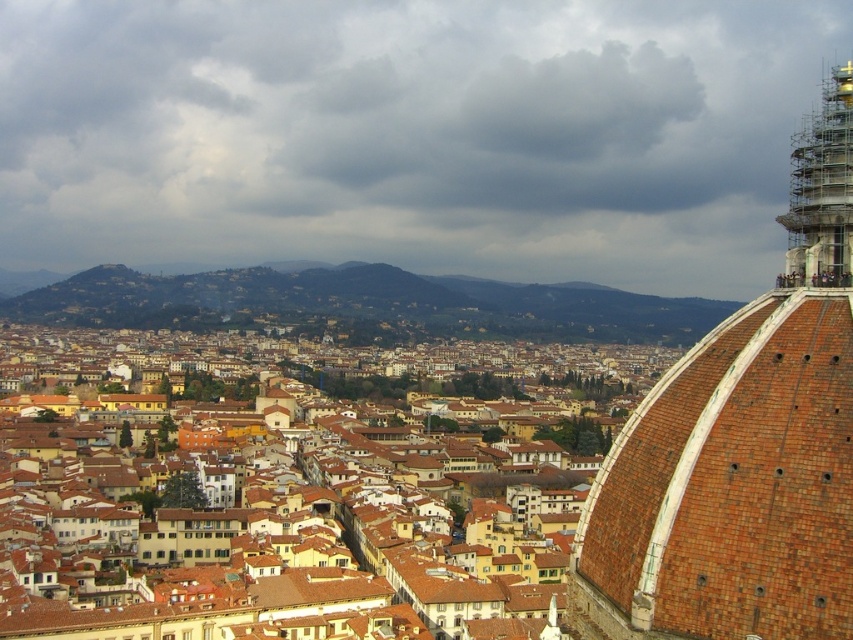
Question: Which of the following is the farthest from the observer?

Choices:
 (A) red brick dome at right
 (B) scaffolding metal spire at upper right

Answer: (B)

Question: Does red brick dome at right appear on the right side of scaffolding metal spire at upper right?

Choices:
 (A) yes
 (B) no

Answer: (B)

Question: Which point is farther to the camera?

Choices:
 (A) (699, 605)
 (B) (834, 72)

Answer: (B)

Question: Can you confirm if red brick dome at right is positioned above scaffolding metal spire at upper right?

Choices:
 (A) no
 (B) yes

Answer: (A)

Question: Is red brick dome at right wider than scaffolding metal spire at upper right?

Choices:
 (A) yes
 (B) no

Answer: (B)